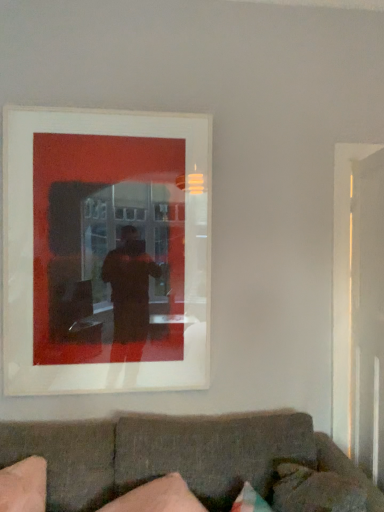
Question: Is matte white picture frame at upper center bigger than pink fabric pillow at lower left, which ranks as the first pillow in left-to-right order?

Choices:
 (A) no
 (B) yes

Answer: (B)

Question: Is matte white picture frame at upper center outside of pink fabric pillow at lower left, acting as the second pillow starting from the right?

Choices:
 (A) yes
 (B) no

Answer: (A)

Question: Is matte white picture frame at upper center oriented towards pink fabric pillow at lower left, acting as the second pillow starting from the right?

Choices:
 (A) yes
 (B) no

Answer: (B)

Question: Is the position of matte white picture frame at upper center less distant than that of pink fabric pillow at lower left, which ranks as the first pillow in left-to-right order?

Choices:
 (A) yes
 (B) no

Answer: (B)

Question: Does matte white picture frame at upper center have a smaller size compared to pink fabric pillow at lower left, which ranks as the first pillow in left-to-right order?

Choices:
 (A) yes
 (B) no

Answer: (B)

Question: Is point (160, 501) closer or farther from the camera than point (256, 478)?

Choices:
 (A) farther
 (B) closer

Answer: (B)

Question: Is pink fabric pillow at lower left, acting as the second pillow starting from the right, to the left or to the right of dark gray fabric couch at lower center in the image?

Choices:
 (A) right
 (B) left

Answer: (B)

Question: From a real-world perspective, relative to dark gray fabric couch at lower center, is pink fabric pillow at lower left, acting as the second pillow starting from the right, vertically above or below?

Choices:
 (A) below
 (B) above

Answer: (B)

Question: Is pink fabric pillow at lower left, acting as the second pillow starting from the right, in front of or behind dark gray fabric couch at lower center in the image?

Choices:
 (A) front
 (B) behind

Answer: (B)

Question: From the image's perspective, relative to pink fabric pillow at lower left, acting as the second pillow starting from the right, is transparent glass door at right above or below?

Choices:
 (A) above
 (B) below

Answer: (A)

Question: Is transparent glass door at right inside the boundaries of pink fabric pillow at lower left, which ranks as the first pillow in left-to-right order, or outside?

Choices:
 (A) inside
 (B) outside

Answer: (B)

Question: Based on their sizes in the image, would you say transparent glass door at right is bigger or smaller than pink fabric pillow at lower left, which ranks as the first pillow in left-to-right order?

Choices:
 (A) small
 (B) big

Answer: (B)

Question: Considering the positions of transparent glass door at right and pink fabric pillow at lower left, acting as the second pillow starting from the right, in the image, is transparent glass door at right wider or thinner than pink fabric pillow at lower left, acting as the second pillow starting from the right,?

Choices:
 (A) thin
 (B) wide

Answer: (A)

Question: In terms of width, does velvet pink pillow at lower right, placed as the second pillow when sorted from left to right, look wider or thinner when compared to dark gray fabric couch at lower center?

Choices:
 (A) thin
 (B) wide

Answer: (A)

Question: From a real-world perspective, relative to dark gray fabric couch at lower center, is velvet pink pillow at lower right, placed as the second pillow when sorted from left to right, vertically above or below?

Choices:
 (A) above
 (B) below

Answer: (A)